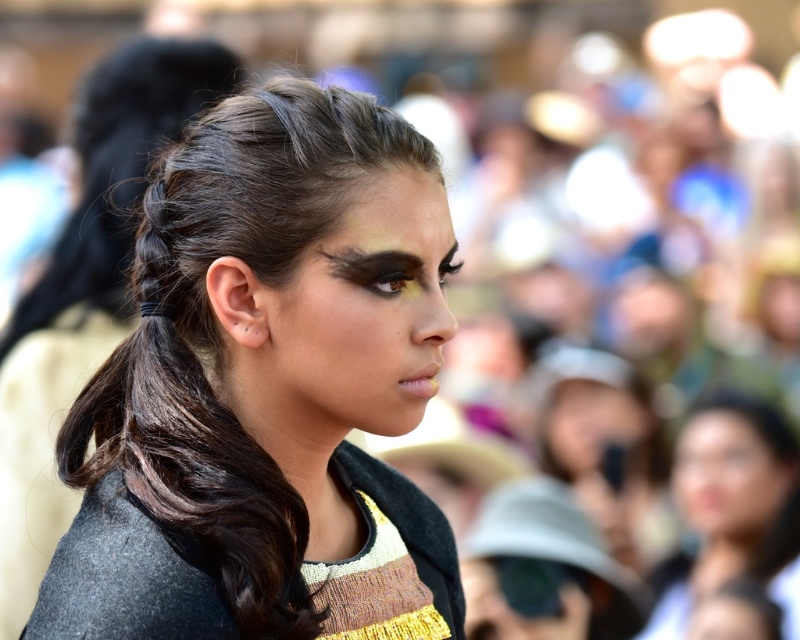
Question: Does matte black face at center appear over matte skin at center?

Choices:
 (A) yes
 (B) no

Answer: (B)

Question: Which point is farther to the camera?

Choices:
 (A) (20, 324)
 (B) (382, 278)
 (C) (734, 428)
 (D) (370, 221)

Answer: (C)

Question: Which point is closer to the camera?

Choices:
 (A) (278, 525)
 (B) (684, 509)
 (C) (748, 444)

Answer: (A)

Question: Can you confirm if dark brown braided hair at center is bigger than matte black hair at lower right?

Choices:
 (A) yes
 (B) no

Answer: (B)

Question: Can you confirm if matte black hair at lower right is smaller than brown matte eye at center?

Choices:
 (A) yes
 (B) no

Answer: (B)

Question: Which object is closer to the camera taking this photo?

Choices:
 (A) matte black hair at center
 (B) matte black hair at lower right
 (C) smooth skin face at lower right

Answer: (A)